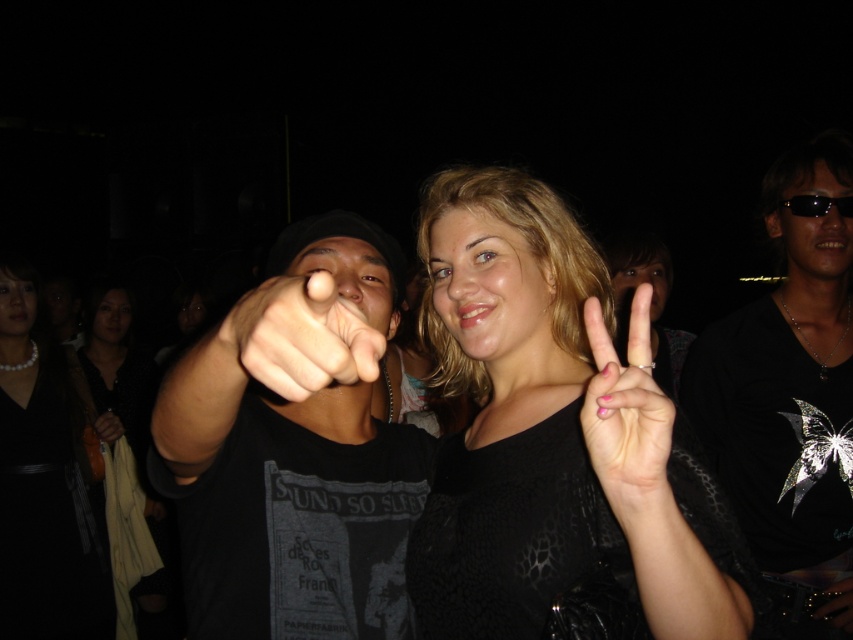
Question: Which object appears closest to the camera in this image?

Choices:
 (A) pink polished nails at center
 (B) dark skin hand at center

Answer: (A)

Question: Based on their relative distances, which object is nearer to the matte black finger at center?

Choices:
 (A) dark skin hand at center
 (B) blonde hair at center
 (C) black shiny t-shirt at right
 (D) black textured shirt at center

Answer: (B)

Question: Among these objects, which one is nearest to the camera?

Choices:
 (A) black textured shirt at center
 (B) pink polished nails at center
 (C) pearl necklace at center
 (D) blonde hair at center

Answer: (B)

Question: Does pearl necklace at center have a greater width compared to black reflective sunglasses at upper right?

Choices:
 (A) no
 (B) yes

Answer: (B)

Question: Considering the relative positions of pink polished nails at center and dark skin hand at center in the image provided, where is pink polished nails at center located with respect to dark skin hand at center?

Choices:
 (A) left
 (B) right

Answer: (B)

Question: Is black textured sweater at center to the left of black textured shirt at center from the viewer's perspective?

Choices:
 (A) no
 (B) yes

Answer: (A)